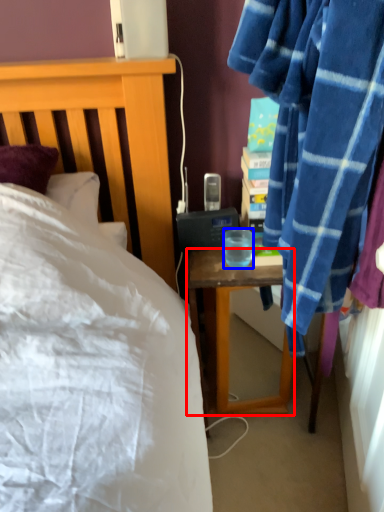
Question: Which object is further to the camera taking this photo, desk (highlighted by a red box) or coffee cup (highlighted by a blue box)?

Choices:
 (A) desk
 (B) coffee cup

Answer: (A)